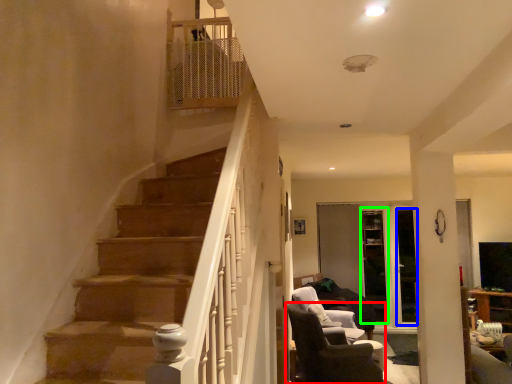
Question: Estimate the real-world distances between objects in this image. Which object is farther from chair (highlighted by a red box), glass door (highlighted by a blue box) or glass door (highlighted by a green box)?

Choices:
 (A) glass door
 (B) glass door

Answer: (A)